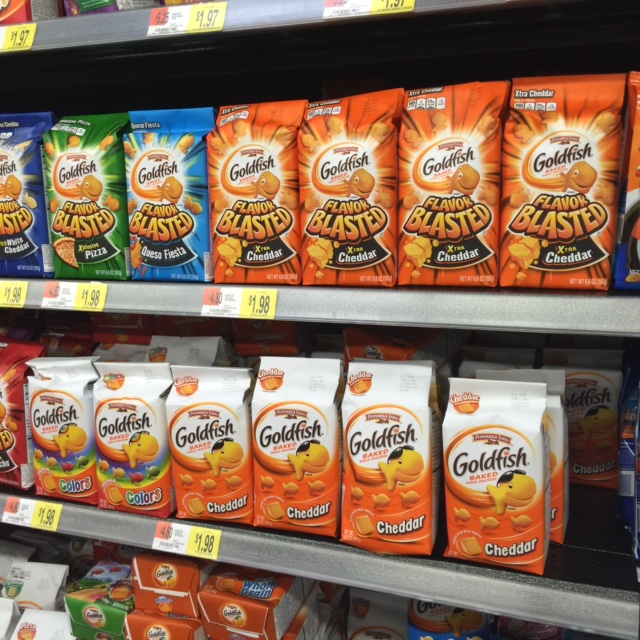
At what (x,y) coordinates should I click in order to perform the action: click on price labels on shelves. Please return your answer as a coordinate pair (x, y). This screenshot has width=640, height=640. Looking at the image, I should click on (22, 35), (383, 4), (191, 13), (15, 292), (79, 291), (248, 298), (44, 518), (180, 534).